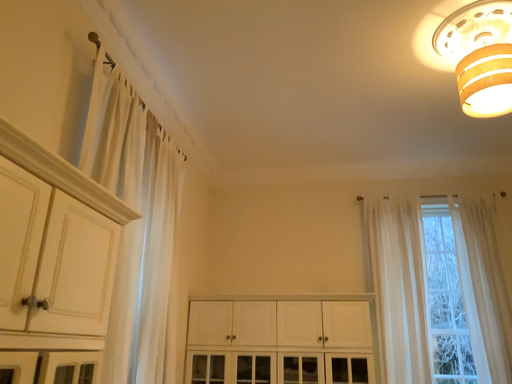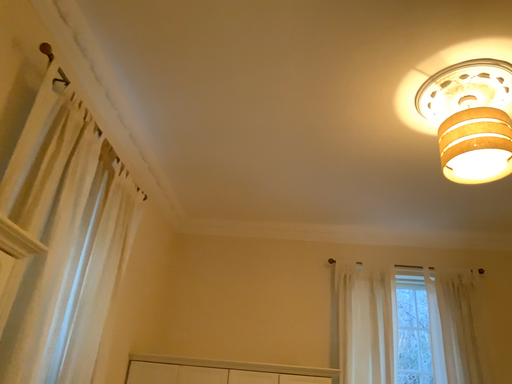
Question: How did the camera likely rotate when shooting the video?

Choices:
 (A) rotated upward
 (B) rotated downward

Answer: (A)